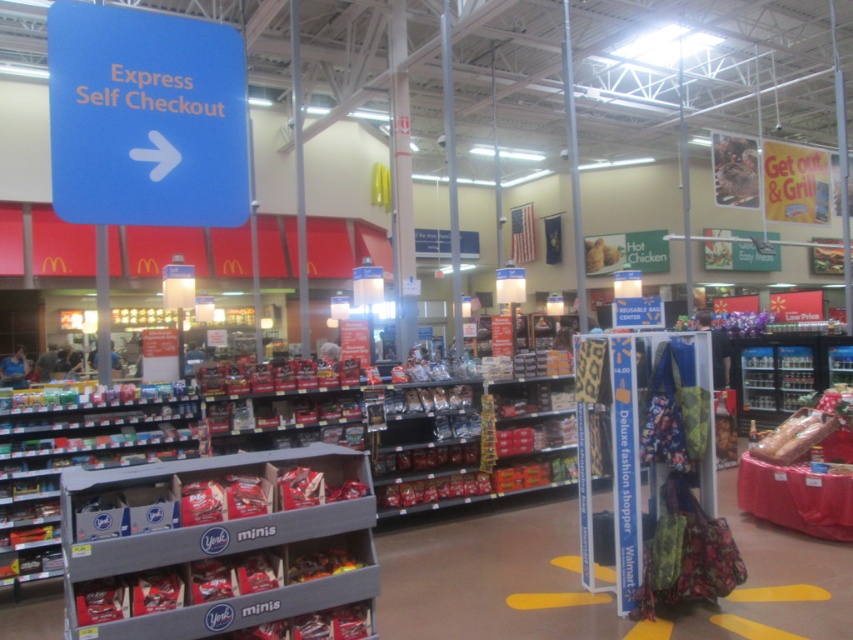
Question: Does gray plastic shelf at lower left appear on the right side of blue plastic sign at upper left?

Choices:
 (A) yes
 (B) no

Answer: (A)

Question: Does gray plastic shelf at lower left come in front of golden crispy chicken at center?

Choices:
 (A) no
 (B) yes

Answer: (B)

Question: Does gray plastic shelf at lower left lie behind blue plastic sign at upper left?

Choices:
 (A) yes
 (B) no

Answer: (A)

Question: Which object appears farthest from the camera in this image?

Choices:
 (A) shiny plastic baguette at right
 (B) gray plastic shelf at lower left
 (C) golden crispy chicken at center

Answer: (C)

Question: Which point is farther to the camera?

Choices:
 (A) (181, 58)
 (B) (65, 483)
 (C) (340, 557)

Answer: (C)

Question: Which of the following is the farthest from the observer?

Choices:
 (A) (585, 252)
 (B) (805, 413)

Answer: (A)